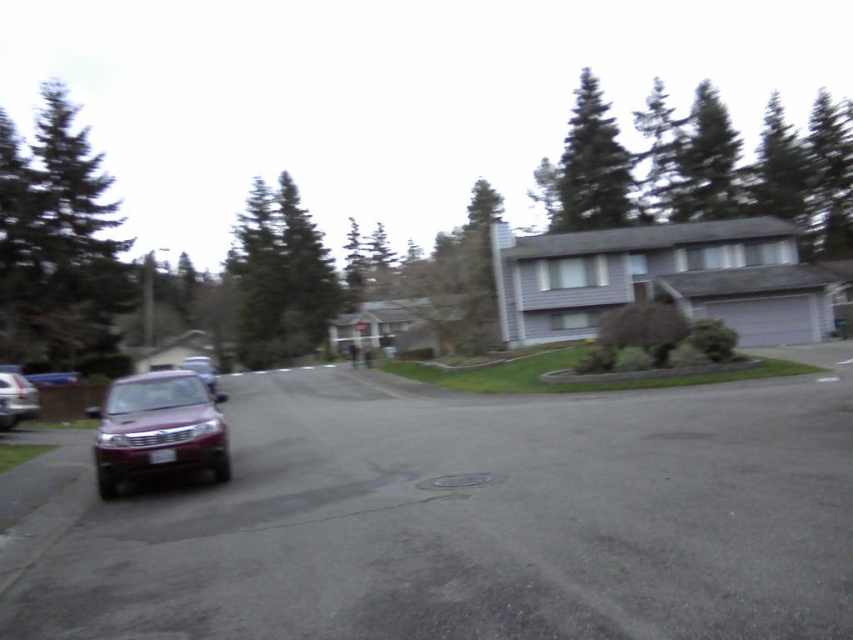
Question: Is green textured tree at upper center wider than satin burgundy suv at left?

Choices:
 (A) yes
 (B) no

Answer: (A)

Question: Which of the following is the farthest from the observer?

Choices:
 (A) [6, 406]
 (B) [106, 369]
 (C) [813, 177]

Answer: (C)

Question: Which of these objects is positioned farthest from the green textured pine tree at upper left?

Choices:
 (A) green textured pine tree at upper center
 (B) satin burgundy suv at left

Answer: (A)

Question: Where is green textured pine tree at upper right located in relation to satin burgundy suv at center-left in the image?

Choices:
 (A) right
 (B) left

Answer: (A)

Question: Can you confirm if metallic silver suv at left is positioned above satin burgundy suv at center-left?

Choices:
 (A) no
 (B) yes

Answer: (B)

Question: Which of the following is the closest to the observer?

Choices:
 (A) metallic silver suv at left
 (B) green textured pine tree at upper left

Answer: (A)